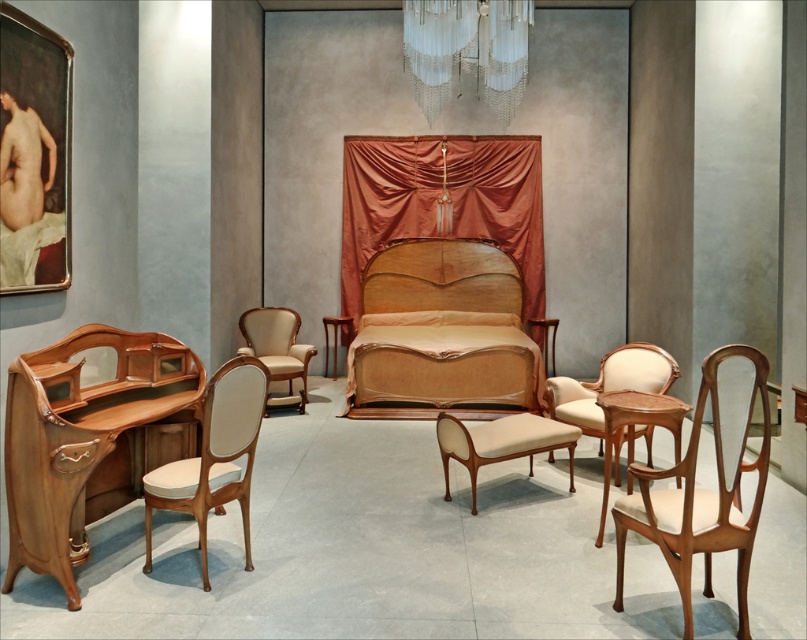
You are an interior designer planning to place a large painting that requires a surface area of 2 square meters. You have the light brown wood desk at lower left and the wooden headboard at center available. Which object can accommodate the painting?

The light brown wood desk at lower left has a larger size compared to the wooden headboard at center, so it can accommodate the painting requiring 2 square meters.

You are an interior designer assessing the dimensions of the furniture in the room. Given that the wooden headboard at center and the beige fabric bench at center are both central to the design, which one has a larger footprint in terms of size?

The beige fabric bench at center has a larger footprint than the wooden headboard at center, as it is stated to be bigger in size.